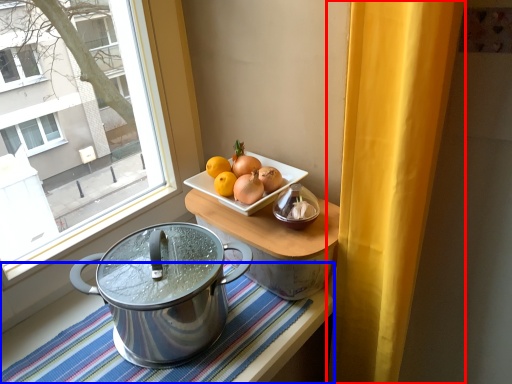
Question: Which point is closer to the camera, curtain (highlighted by a red box) or tablecloth (highlighted by a blue box)?

Choices:
 (A) curtain
 (B) tablecloth

Answer: (A)